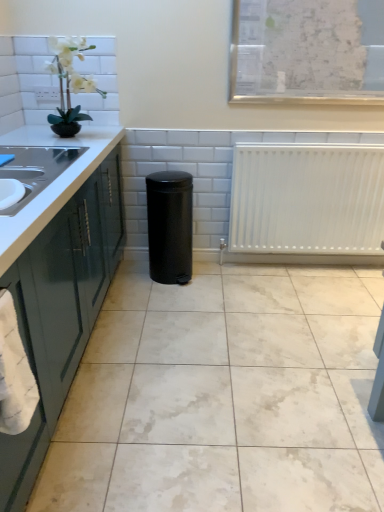
Identify the location of white marble floor at center. The image size is (384, 512). (224, 396).

Measure the distance between white matte radiator at center and camera.

white matte radiator at center is 8.49 feet away from camera.

In order to face white matte radiator at center, should I rotate leftwards or rightwards?

You should look right and rotate roughly 16.334 degrees.

This screenshot has width=384, height=512. What do you see at coordinates (59, 288) in the screenshot?
I see `white glossy countertop at left, the second countertop positioned from the top` at bounding box center [59, 288].

Where is `white marble floor at center`? Image resolution: width=384 pixels, height=512 pixels. white marble floor at center is located at coordinates (224, 396).

You are a GUI agent. You are given a task and a screenshot of the screen. Output one action in this format:
    pyautogui.click(x=<x>, y=<y>)
    Task: Click on the 1st countertop above the white marble floor at center (from the image's perspective)
    Image resolution: width=384 pixels, height=512 pixels.
    Given the screenshot: What is the action you would take?
    pyautogui.click(x=59, y=288)

Considering the relative sizes of white glossy countertop at left, which ranks as the first countertop in bottom-to-top order, and white marble floor at center in the image provided, is white glossy countertop at left, which ranks as the first countertop in bottom-to-top order, thinner than white marble floor at center?

Correct, the width of white glossy countertop at left, which ranks as the first countertop in bottom-to-top order, is less than that of white marble floor at center.

How much distance is there between white glossy countertop at left, the second countertop positioned from the top, and white marble floor at center?

A distance of 25.03 inches exists between white glossy countertop at left, the second countertop positioned from the top, and white marble floor at center.

Is white glossy countertop at left, the second countertop positioned from the top, taller than white marble floor at center?

Correct, white glossy countertop at left, the second countertop positioned from the top, is much taller as white marble floor at center.

Could you tell me if white marble floor at center is facing white matte orchid at upper left?

No, white marble floor at center does not turn towards white matte orchid at upper left.

From the image's perspective, would you say white marble floor at center is positioned over white matte orchid at upper left?

Actually, white marble floor at center appears below white matte orchid at upper left in the image.

Is point (361, 381) behind point (54, 119)?

No, it is in front of (54, 119).

Find the location of a particular element. This screenshot has height=512, width=384. appliance beneath the white matte orchid at upper left (from a real-world perspective) is located at coordinates (170, 226).

Between white matte orchid at upper left and black matte trash can at center, which one appears on the left side from the viewer's perspective?

Positioned to the left is white matte orchid at upper left.

Is white matte orchid at upper left far away from black matte trash can at center?

No, there isn't a large distance between white matte orchid at upper left and black matte trash can at center.

Which is correct: white matte radiator at center is inside white towel at left, or outside of it?

white matte radiator at center cannot be found inside white towel at left.

Image resolution: width=384 pixels, height=512 pixels. Find the location of `radiator behind the white towel at left`. radiator behind the white towel at left is located at coordinates (307, 199).

What's the angular difference between white matte radiator at center and white towel at left's facing directions?

There is a 90.9-degree angle between the facing directions of white matte radiator at center and white towel at left.

Is there a large distance between white matte radiator at center and white towel at left?

Absolutely, white matte radiator at center is distant from white towel at left.

Is white matte radiator at center directly adjacent to white matte orchid at upper left?

No, white matte radiator at center is not next to white matte orchid at upper left.

Considering the positions of objects white matte radiator at center and white matte orchid at upper left in the image provided, who is behind, white matte radiator at center or white matte orchid at upper left?

white matte radiator at center is behind.

Considering the points (326, 238) and (80, 58), which point is behind, point (326, 238) or point (80, 58)?

The point (326, 238) is behind.

Does white matte radiator at center have a greater height compared to white matte orchid at upper left?

Yes.

From the picture: Is white glossy countertop at left, the second countertop positioned from the top, at the left side of white matte orchid at upper left?

Yes, white glossy countertop at left, the second countertop positioned from the top, is to the left of white matte orchid at upper left.

Locate an element on the screen. The image size is (384, 512). houseplant behind the white glossy countertop at left, which ranks as the first countertop in bottom-to-top order is located at coordinates (70, 84).

Is white glossy countertop at left, which ranks as the first countertop in bottom-to-top order, thinner than white matte orchid at upper left?

Incorrect, the width of white glossy countertop at left, which ranks as the first countertop in bottom-to-top order, is not less than that of white matte orchid at upper left.

Can white matte orchid at upper left be found inside white glossy countertop at left, which ranks as the first countertop in bottom-to-top order?

No, white matte orchid at upper left is located outside of white glossy countertop at left, which ranks as the first countertop in bottom-to-top order.

From the image's perspective, which one is positioned higher, black matte trash can at center or white towel at left?

black matte trash can at center appears higher in the image.

Which is more to the right, black matte trash can at center or white towel at left?

black matte trash can at center.

Where is `appliance above the white towel at left (from the image's perspective)`? The image size is (384, 512). appliance above the white towel at left (from the image's perspective) is located at coordinates click(170, 226).

How many degrees apart are the facing directions of black matte trash can at center and white towel at left?

black matte trash can at center and white towel at left are facing 90 degrees away from each other.

Image resolution: width=384 pixels, height=512 pixels. In order to click on the 2nd countertop in front of the white marble floor at center, starting your count from the anchor in this screenshot , I will do `click(59, 288)`.

The height and width of the screenshot is (512, 384). I want to click on houseplant that is on the left side of white marble floor at center, so tap(70, 84).

Based on their spatial positions, is white matte radiator at center or white glossy countertop at left, which ranks as the first countertop in bottom-to-top order, closer to black matte trash can at center?

white glossy countertop at left, which ranks as the first countertop in bottom-to-top order.

Estimate the real-world distances between objects in this image. Which object is closer to white glossy countertop at left, which appears as the second countertop when ordered from the bottom, white towel at left or white matte radiator at center?

The object closer to white glossy countertop at left, which appears as the second countertop when ordered from the bottom, is white towel at left.

In the scene shown: Looking at the image, which one is located further to white glossy countertop at left, the second countertop positioned from the top, white towel at left or black matte trash can at center?

The object further to white glossy countertop at left, the second countertop positioned from the top, is black matte trash can at center.

Based on the photo, based on their spatial positions, is white towel at left or white marble floor at center further from white glossy countertop at left, which ranks as the first countertop in bottom-to-top order?

white marble floor at center lies further to white glossy countertop at left, which ranks as the first countertop in bottom-to-top order, than the other object.

From the image, which object appears to be farther from white towel at left, white matte radiator at center or white glossy countertop at left, which ranks as the first countertop in bottom-to-top order?

white matte radiator at center lies further to white towel at left than the other object.

Looking at the image, which one is located closer to white glossy countertop at left, the second countertop positioned from the top, black matte trash can at center or white paper map at upper right?

black matte trash can at center.

Considering their positions, is white towel at left positioned further to white glossy countertop at left, the second countertop positioned from the top, than white paper map at upper right?

Based on the image, white paper map at upper right appears to be further to white glossy countertop at left, the second countertop positioned from the top.

Considering their positions, is white glossy countertop at left, arranged as the first countertop when viewed from the top, positioned further to white marble floor at center than white matte orchid at upper left?

The object further to white marble floor at center is white matte orchid at upper left.

The image size is (384, 512). What are the coordinates of `countertop between white glossy countertop at left, which ranks as the first countertop in bottom-to-top order, and white marble floor at center from left to right` in the screenshot? It's located at (51, 183).

You are a GUI agent. You are given a task and a screenshot of the screen. Output one action in this format:
    pyautogui.click(x=<x>, y=<y>)
    Task: Click on the screen door between white matte orchid at upper left and white marble floor at center in the vertical direction
    
    Given the screenshot: What is the action you would take?
    pyautogui.click(x=22, y=461)

What are the coordinates of `ceramic tile located between white glossy countertop at left, the second countertop positioned from the top, and white matte radiator at center in the depth direction` in the screenshot? It's located at (224, 396).

This screenshot has height=512, width=384. In order to click on houseplant between white paper map at upper right and white marble floor at center vertically in this screenshot , I will do `click(70, 84)`.